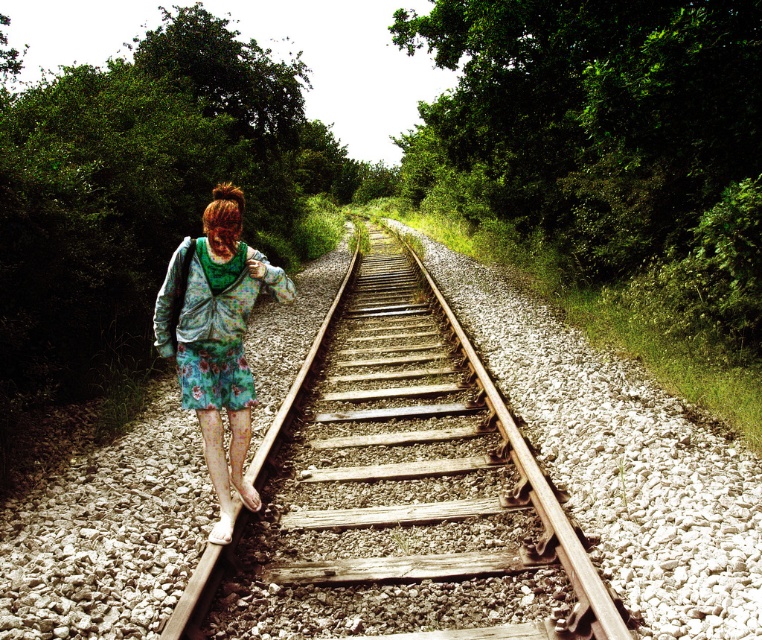
Question: Is wooden track at center further to camera compared to floral fabric skirt at center?

Choices:
 (A) yes
 (B) no

Answer: (B)

Question: Which of the following is the closest to the observer?

Choices:
 (A) wooden track at center
 (B) floral fabric skirt at center
 (C) floral fabric dress at center

Answer: (A)

Question: Is wooden track at center to the left of floral fabric skirt at center from the viewer's perspective?

Choices:
 (A) yes
 (B) no

Answer: (B)

Question: Which point is farther to the camera?

Choices:
 (A) (303, 596)
 (B) (226, 364)

Answer: (B)

Question: Among these points, which one is farthest from the camera?

Choices:
 (A) 242,403
 (B) 309,547
 (C) 207,285

Answer: (A)

Question: Is wooden track at center below floral fabric skirt at center?

Choices:
 (A) no
 (B) yes

Answer: (B)